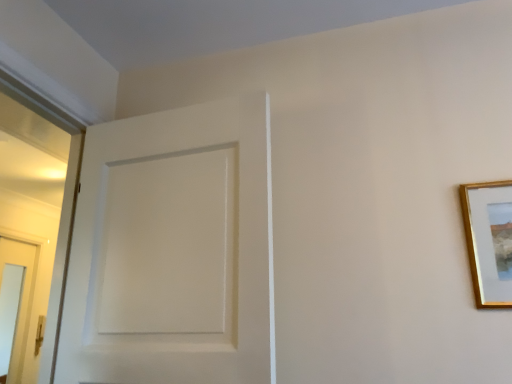
Question: Is point (x=155, y=375) closer or farther from the camera than point (x=478, y=193)?

Choices:
 (A) farther
 (B) closer

Answer: (B)

Question: Looking at their shapes, would you say white matte door at center is wider or thinner than gold wooden picture frame at upper right?

Choices:
 (A) thin
 (B) wide

Answer: (B)

Question: Considering the positions of white matte door at center and gold wooden picture frame at upper right in the image, is white matte door at center taller or shorter than gold wooden picture frame at upper right?

Choices:
 (A) short
 (B) tall

Answer: (B)

Question: Considering their positions, is gold wooden picture frame at upper right located in front of or behind white matte door at center?

Choices:
 (A) front
 (B) behind

Answer: (B)

Question: From a real-world perspective, is gold wooden picture frame at upper right physically located above or below white matte door at center?

Choices:
 (A) above
 (B) below

Answer: (B)

Question: From the image's perspective, is gold wooden picture frame at upper right positioned above or below white matte door at center?

Choices:
 (A) above
 (B) below

Answer: (B)

Question: Looking at the image, does gold wooden picture frame at upper right seem bigger or smaller compared to white matte door at center?

Choices:
 (A) big
 (B) small

Answer: (B)